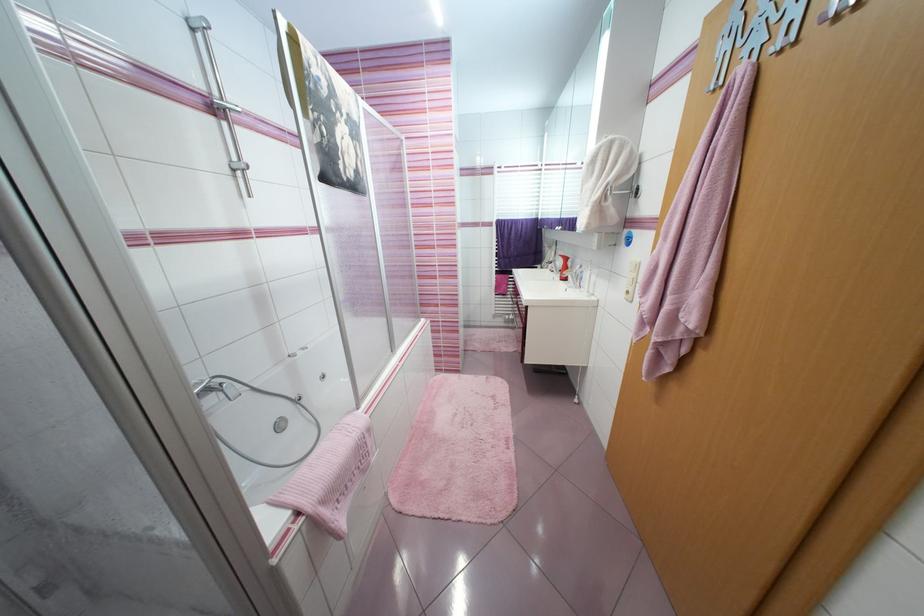
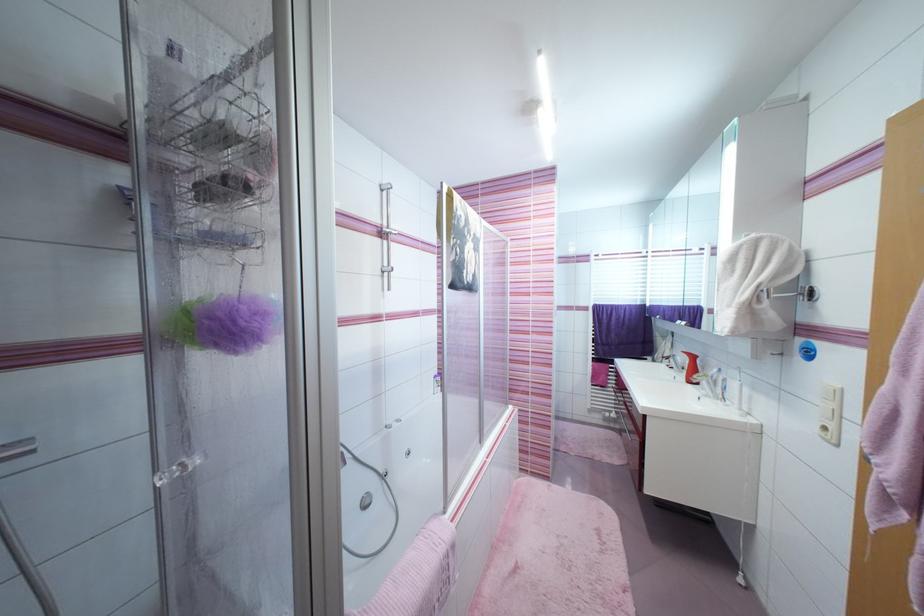
Find the pixel in the second image that matches point 576,288 in the first image.

(711, 398)